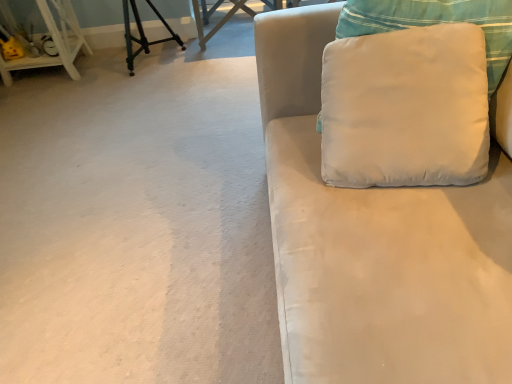
Question: Is white wood shelf at left located outside wooden table at upper center?

Choices:
 (A) no
 (B) yes

Answer: (B)

Question: From the image's perspective, is white wood shelf at left below wooden table at upper center?

Choices:
 (A) no
 (B) yes

Answer: (B)

Question: Can you confirm if white wood shelf at left is positioned to the left of wooden table at upper center?

Choices:
 (A) yes
 (B) no

Answer: (A)

Question: Is white wood shelf at left bigger than wooden table at upper center?

Choices:
 (A) yes
 (B) no

Answer: (B)

Question: Can you confirm if white wood shelf at left is positioned to the right of wooden table at upper center?

Choices:
 (A) no
 (B) yes

Answer: (A)

Question: Would you say white wood shelf at left contains wooden table at upper center?

Choices:
 (A) no
 (B) yes

Answer: (A)

Question: Can you confirm if wooden table at upper center is positioned to the left of satin white couch at right?

Choices:
 (A) yes
 (B) no

Answer: (A)

Question: Is wooden table at upper center at the right side of satin white couch at right?

Choices:
 (A) yes
 (B) no

Answer: (B)

Question: Is wooden table at upper center turned away from satin white couch at right?

Choices:
 (A) no
 (B) yes

Answer: (A)

Question: Would you say wooden table at upper center is outside satin white couch at right?

Choices:
 (A) no
 (B) yes

Answer: (B)

Question: Considering the relative sizes of wooden table at upper center and satin white couch at right in the image provided, is wooden table at upper center wider than satin white couch at right?

Choices:
 (A) no
 (B) yes

Answer: (A)

Question: From the image's perspective, is wooden table at upper center above satin white couch at right?

Choices:
 (A) yes
 (B) no

Answer: (A)

Question: Does wooden table at upper center have a lesser width compared to white wood shelf at left?

Choices:
 (A) yes
 (B) no

Answer: (B)